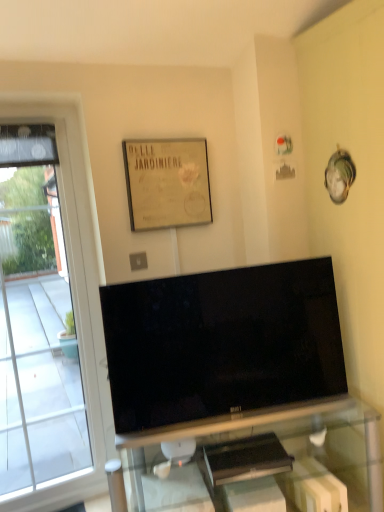
Question: Does beige paper picture frame at upper center come in front of black glossy tv at center?

Choices:
 (A) yes
 (B) no

Answer: (B)

Question: Considering the relative sizes of beige paper picture frame at upper center and black glossy tv at center in the image provided, is beige paper picture frame at upper center thinner than black glossy tv at center?

Choices:
 (A) yes
 (B) no

Answer: (A)

Question: Can you confirm if beige paper picture frame at upper center is positioned to the right of black glossy tv at center?

Choices:
 (A) no
 (B) yes

Answer: (A)

Question: Considering the relative sizes of beige paper picture frame at upper center and black glossy tv at center in the image provided, is beige paper picture frame at upper center bigger than black glossy tv at center?

Choices:
 (A) no
 (B) yes

Answer: (A)

Question: From the image's perspective, is beige paper picture frame at upper center located above black glossy tv at center?

Choices:
 (A) no
 (B) yes

Answer: (B)

Question: In terms of size, does beige paper picture frame at upper center appear bigger or smaller than black glossy tv at center?

Choices:
 (A) small
 (B) big

Answer: (A)

Question: Considering their positions, is beige paper picture frame at upper center located in front of or behind black glossy tv at center?

Choices:
 (A) front
 (B) behind

Answer: (B)

Question: From their relative heights in the image, would you say beige paper picture frame at upper center is taller or shorter than black glossy tv at center?

Choices:
 (A) short
 (B) tall

Answer: (A)

Question: Is beige paper picture frame at upper center inside or outside of black glossy tv at center?

Choices:
 (A) outside
 (B) inside

Answer: (A)

Question: In terms of size, does black glossy tv at center appear bigger or smaller than transparent glass window at left?

Choices:
 (A) big
 (B) small

Answer: (B)

Question: Is point (236, 340) positioned closer to the camera than point (0, 233)?

Choices:
 (A) farther
 (B) closer

Answer: (B)

Question: From the image's perspective, relative to transparent glass window at left, is black glossy tv at center above or below?

Choices:
 (A) below
 (B) above

Answer: (A)

Question: Is black glossy tv at center taller or shorter than transparent glass window at left?

Choices:
 (A) short
 (B) tall

Answer: (A)

Question: Relative to transparent glass tv stand at center, is transparent glass window at left in front or behind?

Choices:
 (A) front
 (B) behind

Answer: (B)

Question: In the image, is transparent glass window at left on the left side or the right side of transparent glass tv stand at center?

Choices:
 (A) right
 (B) left

Answer: (B)